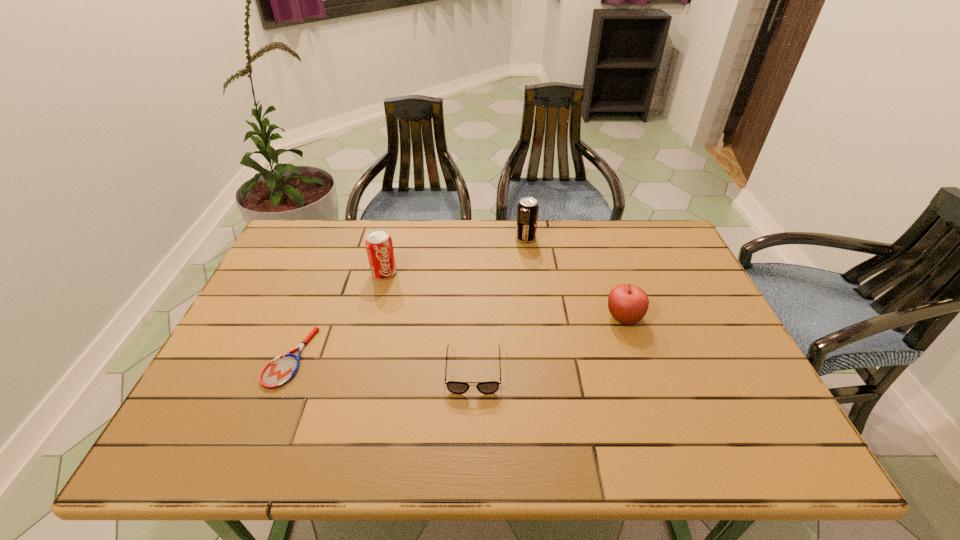
The image size is (960, 540). I want to click on vacant area at the right edge, so click(658, 287).

I want to click on free spot at the far left corner of the desktop, so click(332, 248).

What are the coordinates of `blank space at the far right corner of the desktop` in the screenshot? It's located at (627, 228).

The height and width of the screenshot is (540, 960). In the image, there is a desktop. Identify the location of vacant space at the near right corner. (784, 439).

Where is `unoccupied position between the nearer soda can and the tennis racket`? This screenshot has width=960, height=540. unoccupied position between the nearer soda can and the tennis racket is located at coordinates (337, 315).

This screenshot has width=960, height=540. What are the coordinates of `empty space that is in between the spectacles and the fourth nearest object` in the screenshot? It's located at (429, 321).

Where is `vacant space in between the second object from left to right and the farther soda can`? vacant space in between the second object from left to right and the farther soda can is located at coordinates (455, 255).

At what (x,y) coordinates should I click in order to perform the action: click on free space between the farther soda can and the shortest object. Please return your answer as a coordinate pair (x, y). The width and height of the screenshot is (960, 540). Looking at the image, I should click on (408, 298).

This screenshot has width=960, height=540. In order to click on free point between the tennis racket and the second farthest object in this screenshot , I will do `click(337, 315)`.

The width and height of the screenshot is (960, 540). What are the coordinates of `vacant space in between the tennis racket and the fourth tallest object` in the screenshot? It's located at (382, 364).